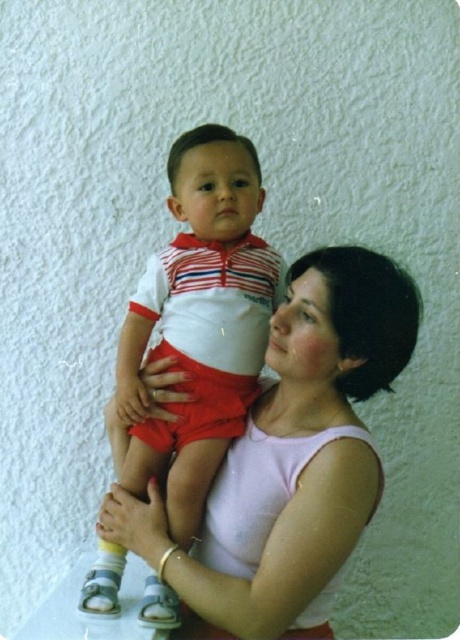
You are an artist sketching this scene and want to ensure proper perspective. Which of the two points, point (x=281, y=582) or point (x=173, y=273), should you draw closer to the front of your canvas?

Point (x=281, y=582) should be drawn closer to the front of the canvas because it is closer to the viewer than point (x=173, y=273) according to the spatial description.

From the picture: You are a photographer trying to focus on the pink fabric shirt at center and the matte white and red striped shirt at center. Which one should you adjust your camera lens to focus on first if you want to capture both in sharp detail?

The pink fabric shirt at center should be focused on first because it is closer to the viewer than the matte white and red striped shirt at center, so adjusting focus starting from the closer object ensures both can be in sharp detail.

You are a photographer setting up a photo shoot. You have two outfits to choose from for the main subject. The pink fabric shirt at center and the matte white and red striped shirt at center. Based on the scene description, which outfit would you recommend for the main subject to ensure visibility against the light colored wall?

The pink fabric shirt at center is larger in size than the matte white and red striped shirt at center, so the pink fabric shirt at center would be more visible against the light colored wall due to its larger size.